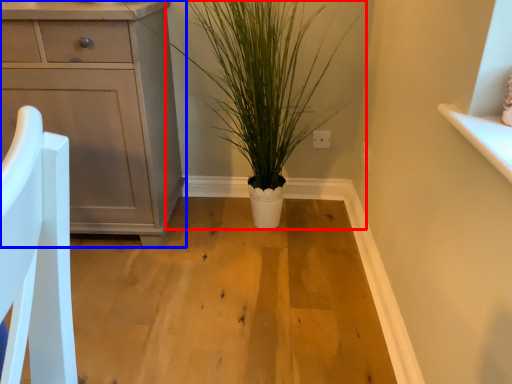
Question: Which object is further to the camera taking this photo, houseplant (highlighted by a red box) or chest of drawers (highlighted by a blue box)?

Choices:
 (A) houseplant
 (B) chest of drawers

Answer: (B)